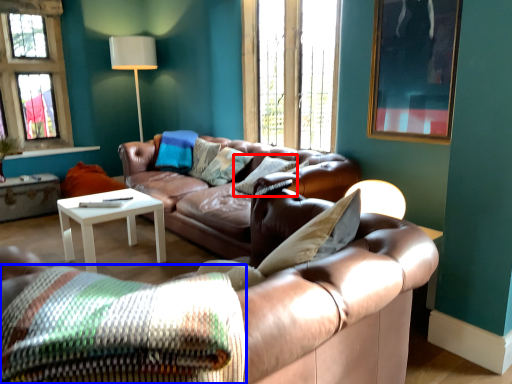
Question: Which point is further to the camera, pillow (highlighted by a red box) or pillow (highlighted by a blue box)?

Choices:
 (A) pillow
 (B) pillow

Answer: (A)